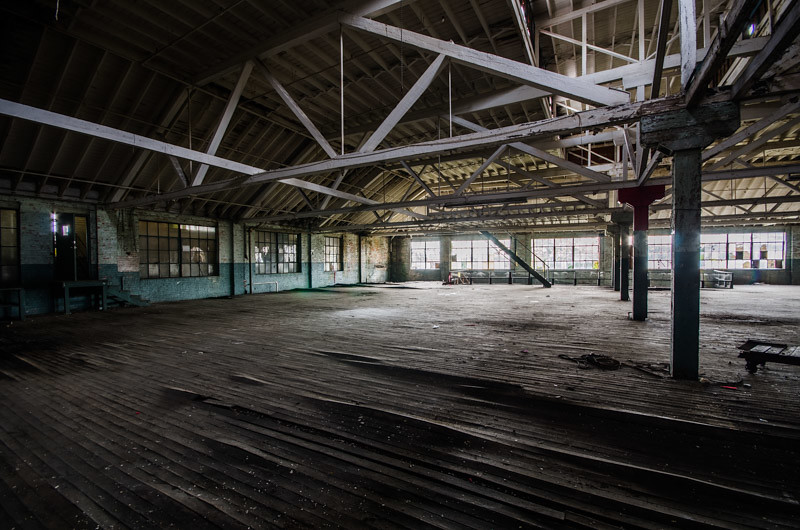
Find the location of a particular element. The width and height of the screenshot is (800, 530). stairs is located at coordinates (520, 261), (118, 296).